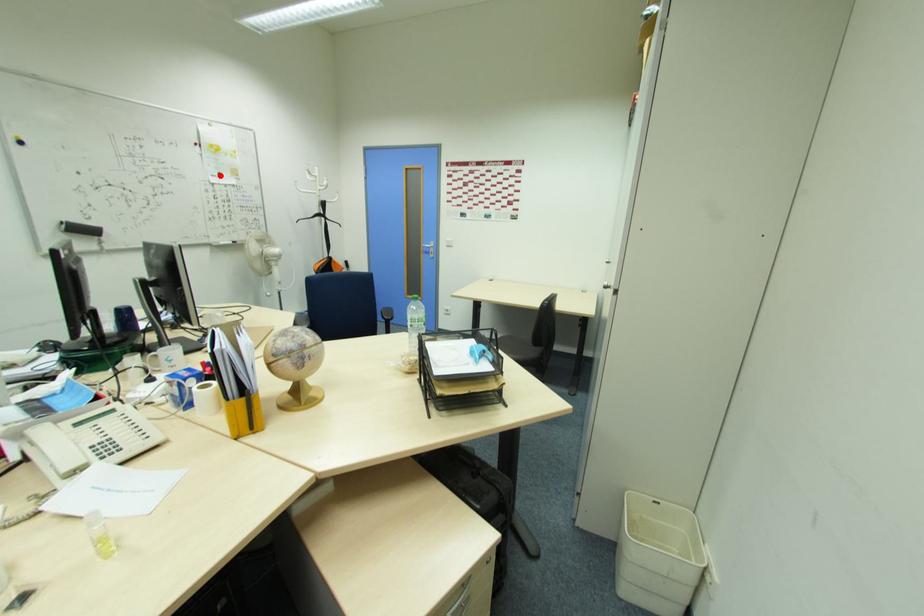
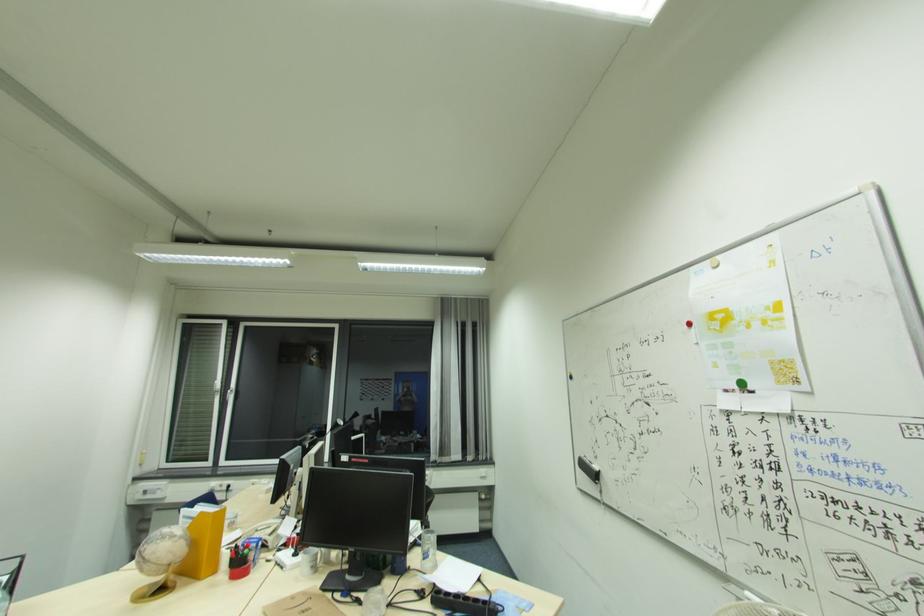
The point at the highlighted location is marked in the first image. Where is the corresponding point in the second image?

(739, 387)